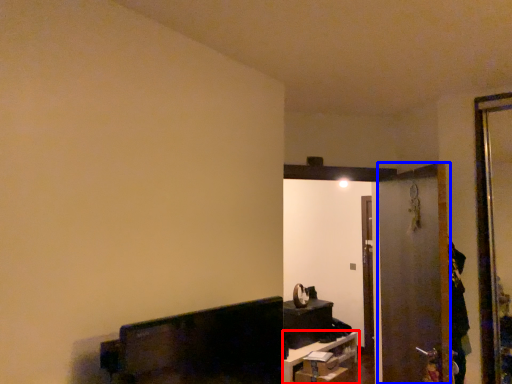
Question: Which object appears closest to the camera in this image, furniture (highlighted by a red box) or screen door (highlighted by a blue box)?

Choices:
 (A) furniture
 (B) screen door

Answer: (B)